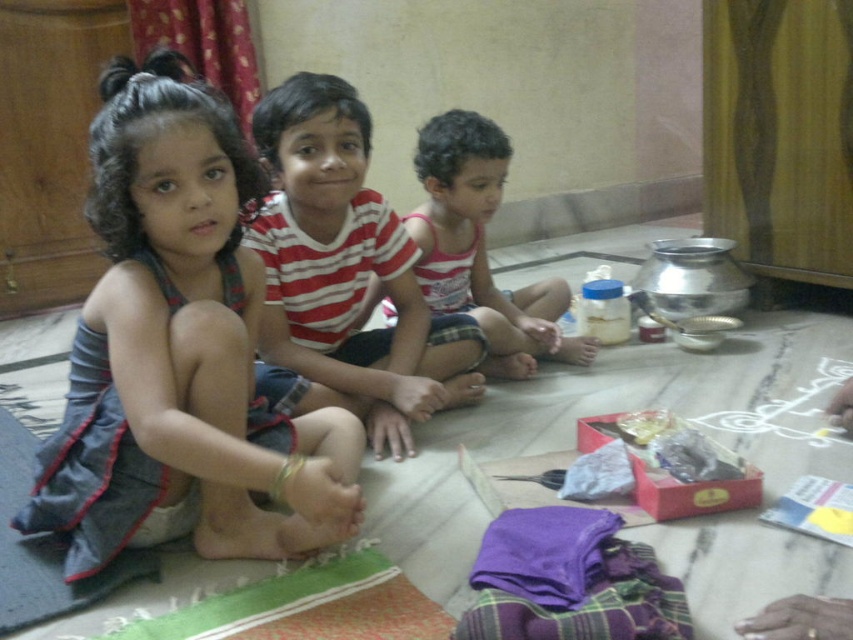
Question: Which of the following is the closest to the observer?

Choices:
 (A) matte pink tank top at center
 (B) striped cotton shirt at center

Answer: (B)

Question: Which point appears closest to the camera in this image?

Choices:
 (A) (338, 115)
 (B) (90, 556)
 (C) (1, 605)
 (D) (473, 182)

Answer: (C)

Question: Is matte pink tank top at center wider than dark grey fabric mat at lower left?

Choices:
 (A) yes
 (B) no

Answer: (B)

Question: Where is matte pink tank top at center located in relation to dark grey fabric mat at lower left in the image?

Choices:
 (A) below
 (B) above

Answer: (B)

Question: Which point appears closest to the camera in this image?

Choices:
 (A) coord(328,150)
 (B) coord(9,566)

Answer: (B)

Question: Is denim skirt at center to the left of striped cotton shirt at center from the viewer's perspective?

Choices:
 (A) yes
 (B) no

Answer: (A)